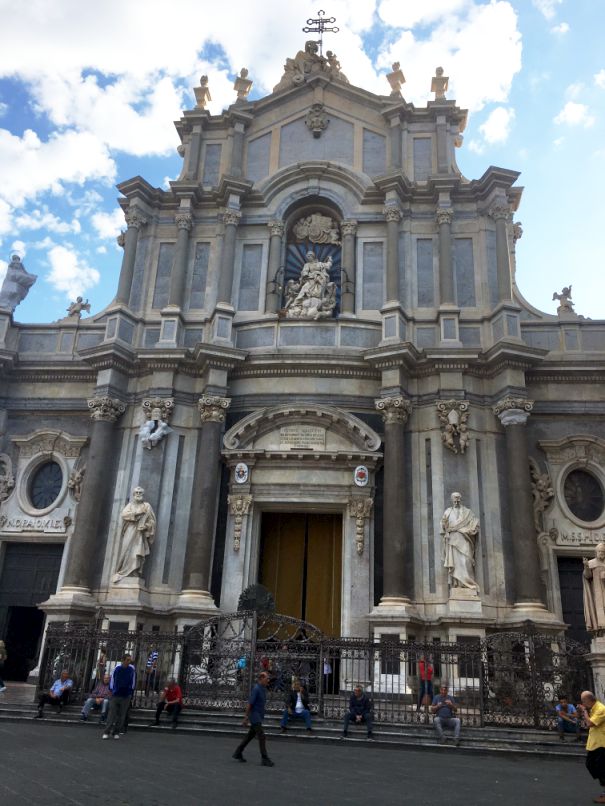
Image resolution: width=605 pixels, height=806 pixels. I want to click on brown curtains, so click(x=283, y=574), click(x=321, y=580).